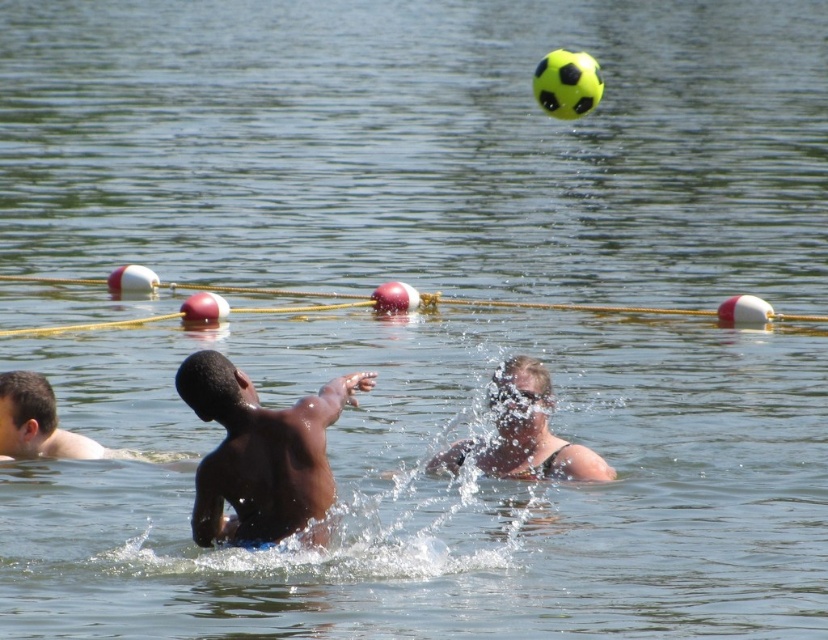
Who is higher up, dark skin human at center or smooth skin man at center?

dark skin human at center is higher up.

Measure the distance between point (297, 509) and camera.

17.35 meters

Which is in front, point (201, 541) or point (520, 458)?

Point (201, 541)

The height and width of the screenshot is (640, 828). I want to click on dark skin human at center, so [x=260, y=452].

Is smooth skin man at center further to the viewer compared to light brown skin at lower left?

No, it is in front of light brown skin at lower left.

Who is higher up, smooth skin man at center or light brown skin at lower left?

light brown skin at lower left is above.

Who is more forward, (513, 388) or (3, 381)?

Point (513, 388) is in front.

Image resolution: width=828 pixels, height=640 pixels. What are the coordinates of `smooth skin man at center` in the screenshot? It's located at (523, 433).

Is the position of dark skin human at center less distant than that of light brown skin at lower left?

Yes, dark skin human at center is in front of light brown skin at lower left.

Identify the location of dark skin human at center. The image size is (828, 640). (260, 452).

Who is more distant from viewer, (244, 401) or (26, 451)?

The point (26, 451) is more distant.

Identify the location of dark skin human at center. (260, 452).